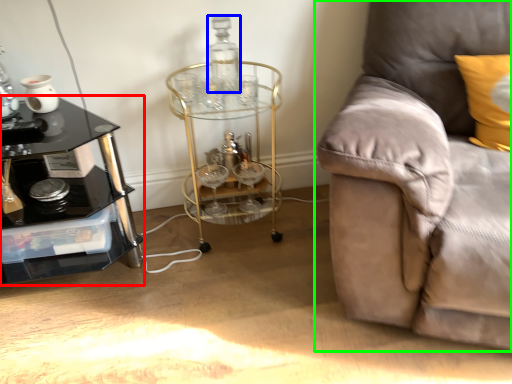
Question: Which object is the closest to the table (highlighted by a red box)? Choose among these: bottle (highlighted by a blue box) or studio couch (highlighted by a green box).

Choices:
 (A) bottle
 (B) studio couch

Answer: (A)